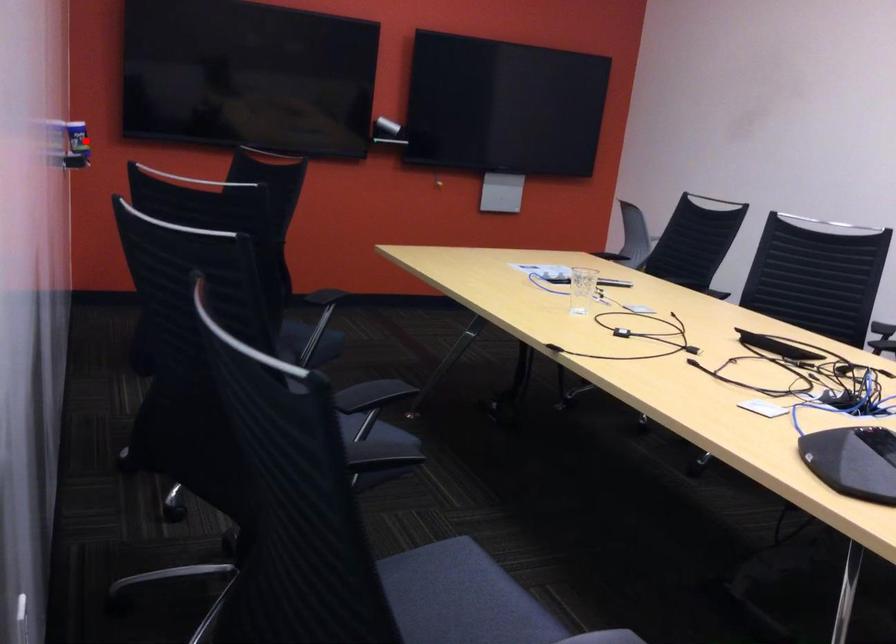
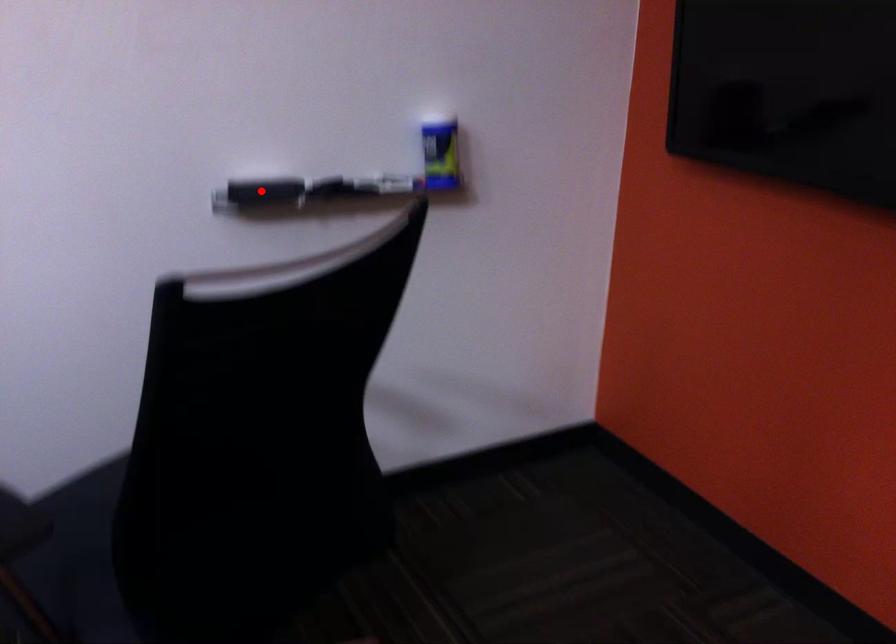
I am providing you with two images of the same scene from different viewpoints. A red point is marked on the first image and another point is marked on the second image. Is the red point in image1 aligned with the point shown in image2?

No